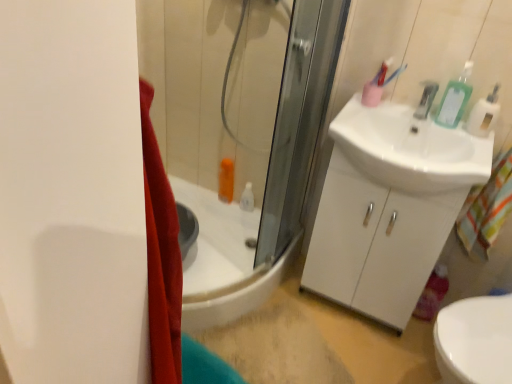
Question: Is white glossy sink at right smaller than metallic silver faucet at upper right?

Choices:
 (A) no
 (B) yes

Answer: (A)

Question: Can we say white glossy sink at right lies outside metallic silver faucet at upper right?

Choices:
 (A) yes
 (B) no

Answer: (A)

Question: Is metallic silver faucet at upper right a part of white glossy sink at right?

Choices:
 (A) no
 (B) yes

Answer: (A)

Question: From the image's perspective, is white glossy sink at right above metallic silver faucet at upper right?

Choices:
 (A) no
 (B) yes

Answer: (A)

Question: Can you confirm if white glossy sink at right is positioned to the right of metallic silver faucet at upper right?

Choices:
 (A) no
 (B) yes

Answer: (A)

Question: Considering their positions, is white glossy cabinet at right located in front of or behind white plastic soap dispenser at upper right?

Choices:
 (A) behind
 (B) front

Answer: (A)

Question: Is point 311,238 positioned closer to the camera than point 492,99?

Choices:
 (A) closer
 (B) farther

Answer: (B)

Question: Considering the positions of white glossy cabinet at right and white plastic soap dispenser at upper right in the image, is white glossy cabinet at right taller or shorter than white plastic soap dispenser at upper right?

Choices:
 (A) short
 (B) tall

Answer: (B)

Question: Do you think white glossy cabinet at right is within white plastic soap dispenser at upper right, or outside of it?

Choices:
 (A) outside
 (B) inside

Answer: (A)

Question: Based on their positions, is white glossy cabinet at right located to the left or right of white glossy sink at right?

Choices:
 (A) left
 (B) right

Answer: (A)

Question: Is white glossy cabinet at right inside the boundaries of white glossy sink at right, or outside?

Choices:
 (A) outside
 (B) inside

Answer: (A)

Question: In the image, is white glossy cabinet at right positioned in front of or behind white glossy sink at right?

Choices:
 (A) behind
 (B) front

Answer: (A)

Question: Is point (437, 230) positioned closer to the camera than point (362, 125)?

Choices:
 (A) closer
 (B) farther

Answer: (A)

Question: In the image, is metallic silver faucet at upper right on the left side or the right side of white glossy cabinet at right?

Choices:
 (A) left
 (B) right

Answer: (B)

Question: Is metallic silver faucet at upper right in front of or behind white glossy cabinet at right in the image?

Choices:
 (A) behind
 (B) front

Answer: (A)